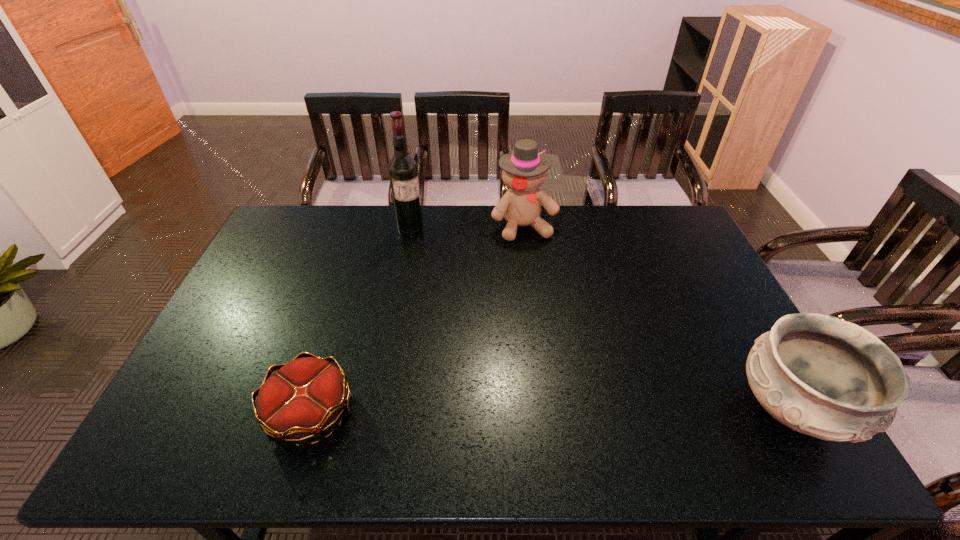
Where is `vacant space on the desktop that is between the shortest object and the rightmost object and is positioned on the front and back of the wine bottle`? This screenshot has height=540, width=960. vacant space on the desktop that is between the shortest object and the rightmost object and is positioned on the front and back of the wine bottle is located at coordinates (510, 412).

In order to click on vacant spot on the desktop that is between the shortest object and the rightmost object and is positioned on the front-facing side of the third object from left to right in this screenshot , I will do `click(612, 411)`.